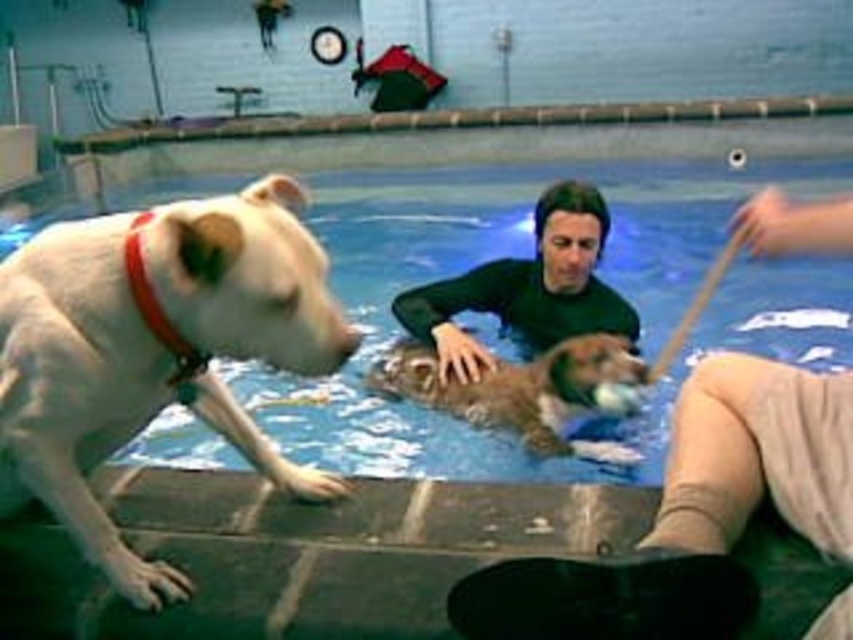
Between white matte dog at left and brown furry dog at center, which one is positioned higher?

Positioned higher is white matte dog at left.

From the picture: Between white matte dog at left and brown furry dog at center, which one appears on the left side from the viewer's perspective?

white matte dog at left

Locate an element on the screen. white matte dog at left is located at coordinates (154, 349).

Between point (253, 188) and point (454, 337), which one is positioned behind?

Positioned behind is point (454, 337).

Is point (131, 432) behind point (527, 260)?

No, (131, 432) is in front of (527, 260).

I want to click on white matte dog at left, so click(x=154, y=349).

Which is above, dark green wetsuit at center or brown furry dog at center?

dark green wetsuit at center

What do you see at coordinates (526, 288) in the screenshot?
I see `dark green wetsuit at center` at bounding box center [526, 288].

This screenshot has width=853, height=640. I want to click on dark green wetsuit at center, so click(526, 288).